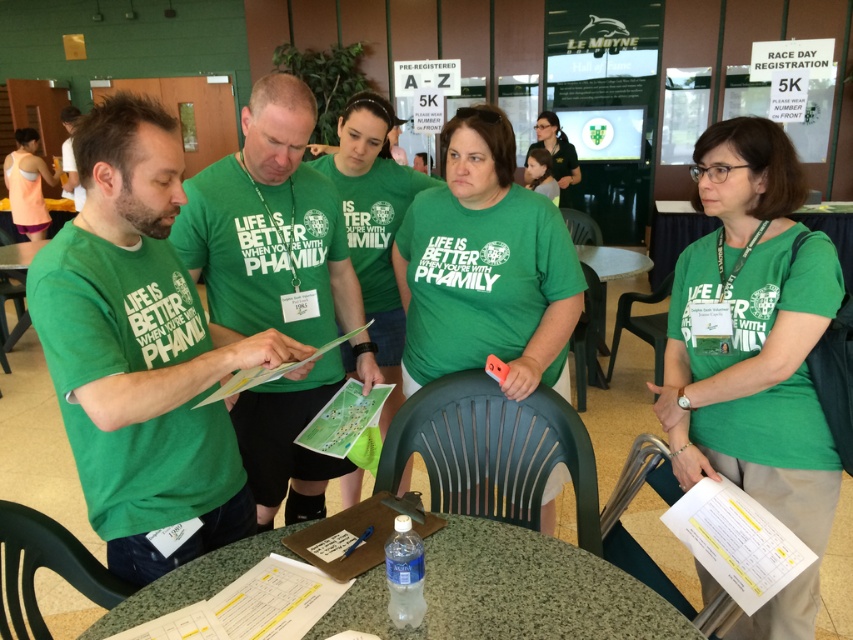
Who is positioned more to the right, green matte shirt at center or matte green t-shirt at center?

Positioned to the right is matte green t-shirt at center.

Is green matte shirt at center wider than matte green t-shirt at center?

No, green matte shirt at center is not wider than matte green t-shirt at center.

What are the coordinates of `green matte shirt at center` in the screenshot? It's located at (140, 349).

Where is `green matte shirt at center`? The width and height of the screenshot is (853, 640). green matte shirt at center is located at coordinates (140, 349).

Between matte green t-shirt at center and green plastic table at center, which one is positioned higher?

matte green t-shirt at center is higher up.

Who is taller, matte green t-shirt at center or green plastic table at center?

matte green t-shirt at center is taller.

Image resolution: width=853 pixels, height=640 pixels. What are the coordinates of `matte green t-shirt at center` in the screenshot? It's located at (270, 228).

Locate an element on the screen. matte green t-shirt at center is located at coordinates (270, 228).

Does point (271, 472) come closer to viewer compared to point (49, 180)?

Yes, point (271, 472) is closer to viewer.

Who is more distant from viewer, (x=281, y=244) or (x=32, y=204)?

Point (x=32, y=204)

What are the coordinates of `matte green t-shirt at center` in the screenshot? It's located at (270, 228).